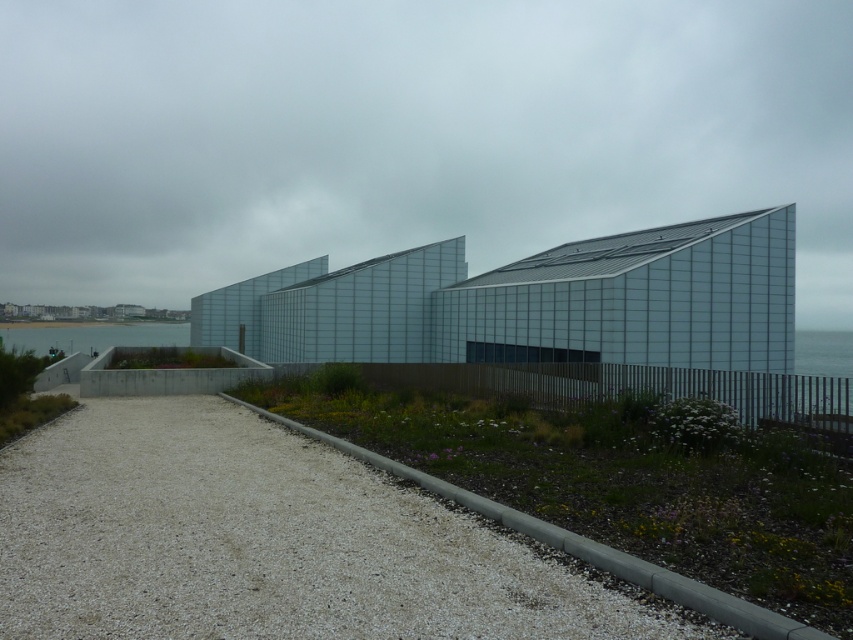
You are standing at the entrance of the modern building and notice the white gravel at lower left and the clear water at lower left. Which of these two elements is lower in elevation?

The white gravel at lower left has a lesser height compared to the clear water at lower left, so the white gravel at lower left is lower in elevation.

You are a landscape architect designing a pathway for this modern building. You need to choose between using the white gravel at lower left or the clear water at lower left for the pathway material. Based on their sizes, which material would you recommend and why?

The white gravel at lower left has a smaller size compared to the clear water at lower left. Therefore, if you prefer a finer texture for the pathway, the white gravel at lower left would be suitable. However, if you want a larger material, the clear water at lower left might not be appropriate as it is a liquid and cannot serve as a solid pathway material.

You are a landscape architect designing a walkway near the building. You need to decide which material to use for the base of the walkway. The options are the white gravel at lower left or the clear water at lower left. Based on the scene, which material has a narrower width at the lower left section?

The white gravel at lower left is thinner than clear water at lower left, so the white gravel at lower left has a narrower width at the lower left section.